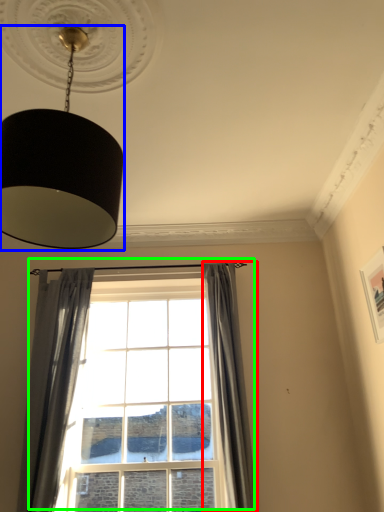
Question: Based on their relative distances, which object is farther from curtain (highlighted by a red box)? Choose from lamp (highlighted by a blue box) and window (highlighted by a green box).

Choices:
 (A) lamp
 (B) window

Answer: (A)